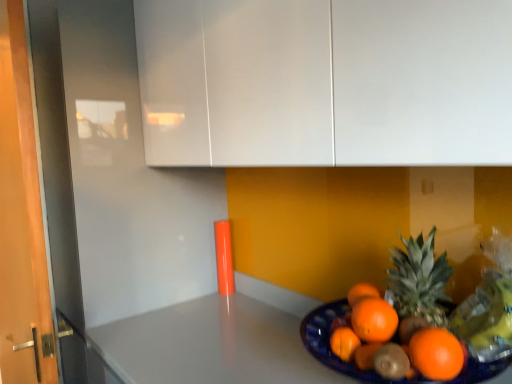
What is the approximate height of blue glossy plate at lower right?

The height of blue glossy plate at lower right is 3.02 inches.

Locate an element on the screen. The height and width of the screenshot is (384, 512). blue glossy plate at lower right is located at coordinates (212, 344).

What do you see at coordinates (212, 344) in the screenshot?
I see `blue glossy plate at lower right` at bounding box center [212, 344].

Where is `white glossy cabinet at upper center`? This screenshot has height=384, width=512. white glossy cabinet at upper center is located at coordinates (325, 82).

Describe the element at coordinates (325, 82) in the screenshot. I see `white glossy cabinet at upper center` at that location.

Where is `blue glossy plate at lower right`? The image size is (512, 384). blue glossy plate at lower right is located at coordinates (212, 344).

Between blue glossy plate at lower right and white glossy cabinet at upper center, which one appears on the left side from the viewer's perspective?

white glossy cabinet at upper center is more to the left.

Which object is further away from the camera taking this photo, blue glossy plate at lower right or white glossy cabinet at upper center?

blue glossy plate at lower right is behind.

Considering the points (248, 310) and (388, 73), which point is behind, point (248, 310) or point (388, 73)?

Point (248, 310)

From the image's perspective, which is below, blue glossy plate at lower right or white glossy cabinet at upper center?

blue glossy plate at lower right, from the image's perspective.

From a real-world perspective, is blue glossy plate at lower right on white glossy cabinet at upper center?

No.

Which object is thinner, blue glossy plate at lower right or white glossy cabinet at upper center?

With smaller width is blue glossy plate at lower right.

Is blue glossy plate at lower right shorter than white glossy cabinet at upper center?

Yes.

Considering the relative sizes of blue glossy plate at lower right and white glossy cabinet at upper center in the image provided, is blue glossy plate at lower right bigger than white glossy cabinet at upper center?

Actually, blue glossy plate at lower right might be smaller than white glossy cabinet at upper center.

Is white glossy cabinet at upper center completely or partially inside blue glossy plate at lower right?

No, blue glossy plate at lower right does not contain white glossy cabinet at upper center.

Are blue glossy plate at lower right and white glossy cabinet at upper center beside each other?

blue glossy plate at lower right is not next to white glossy cabinet at upper center, and they're not touching.

Is blue glossy plate at lower right oriented away from white glossy cabinet at upper center?

blue glossy plate at lower right is not turned away from white glossy cabinet at upper center.

How many degrees apart are the facing directions of blue glossy plate at lower right and white glossy cabinet at upper center?

They differ by 0.27 degrees in their facing directions.

The height and width of the screenshot is (384, 512). I want to click on counter top that is on the right side of white glossy cabinet at upper center, so click(212, 344).

Looking at this image, would you say white glossy cabinet at upper center is to the left or to the right of blue glossy plate at lower right in the picture?

Based on their positions, white glossy cabinet at upper center is located to the left of blue glossy plate at lower right.

Is the position of white glossy cabinet at upper center less distant than that of blue glossy plate at lower right?

That is True.

Is point (191, 76) closer to camera compared to point (205, 336)?

Yes, it is.

From the image's perspective, is white glossy cabinet at upper center positioned above or below blue glossy plate at lower right?

white glossy cabinet at upper center is above blue glossy plate at lower right.

From a real-world perspective, who is located higher, white glossy cabinet at upper center or blue glossy plate at lower right?

white glossy cabinet at upper center is physically above.

Considering the relative sizes of white glossy cabinet at upper center and blue glossy plate at lower right in the image provided, is white glossy cabinet at upper center thinner than blue glossy plate at lower right?

In fact, white glossy cabinet at upper center might be wider than blue glossy plate at lower right.

Between white glossy cabinet at upper center and blue glossy plate at lower right, which one has more height?

white glossy cabinet at upper center is taller.

Does white glossy cabinet at upper center have a larger size compared to blue glossy plate at lower right?

Yes, white glossy cabinet at upper center is bigger than blue glossy plate at lower right.

Could blue glossy plate at lower right be considered to be inside white glossy cabinet at upper center?

That's incorrect, blue glossy plate at lower right is not inside white glossy cabinet at upper center.

Does white glossy cabinet at upper center touch blue glossy plate at lower right?

white glossy cabinet at upper center and blue glossy plate at lower right are clearly separated.

Could you tell me if white glossy cabinet at upper center is facing blue glossy plate at lower right?

No, white glossy cabinet at upper center is not aimed at blue glossy plate at lower right.

How many degrees apart are the facing directions of white glossy cabinet at upper center and blue glossy plate at lower right?

The angle between the facing direction of white glossy cabinet at upper center and the facing direction of blue glossy plate at lower right is 0.27 degrees.

How much distance is there between white glossy cabinet at upper center and blue glossy plate at lower right?

24.85 inches.

Find the location of a particular element. The image size is (512, 384). cabinetry in front of the blue glossy plate at lower right is located at coordinates click(x=325, y=82).

This screenshot has width=512, height=384. In order to click on counter top that appears below the white glossy cabinet at upper center (from the image's perspective) in this screenshot , I will do `click(212, 344)`.

Identify the location of counter top below the white glossy cabinet at upper center (from a real-world perspective). (212, 344).